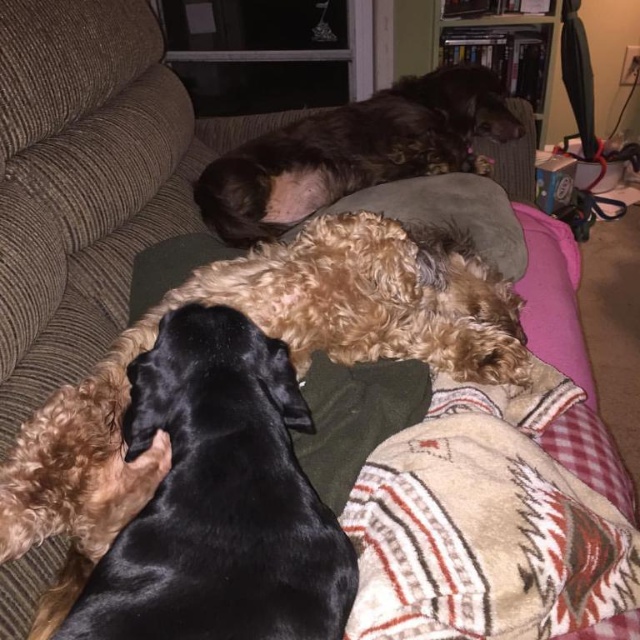
You are a dog owner who wants to place a new toy between the plaid fleece blanket at lower right and the shiny brown fur at upper center. The toy requires 80 centimeters of space. Can you fit it there?

The plaid fleece blanket at lower right and shiny brown fur at upper center are 78.68 centimeters apart. Since the required space for the toy is 80 centimeters, which is more than the available distance, the toy cannot be placed between them.

Looking at this image, you are a dog owner who wants to place a new toy for the black silky dog at center. The toy is 15 cm in length. You have two options for placement areas on the couch. The first area is near the plaid fleece blanket at lower right, and the second area is near the green cushion. Which area has enough space for the toy?

The plaid fleece blanket at lower right is larger than the black silky dog at center, so placing the toy near the plaid fleece blanket at lower right would provide more space for the toy compared to the area near the green cushion.